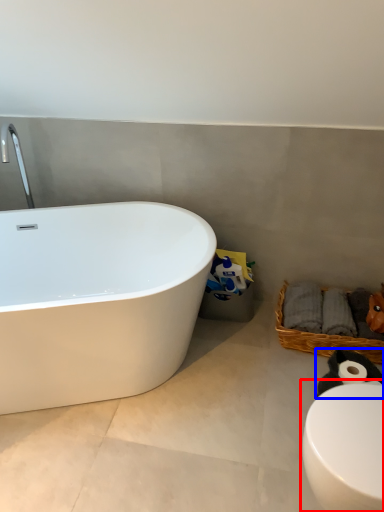
Question: Which object appears farthest to the camera in this image, toilet (highlighted by a red box) or animal (highlighted by a blue box)?

Choices:
 (A) toilet
 (B) animal

Answer: (B)